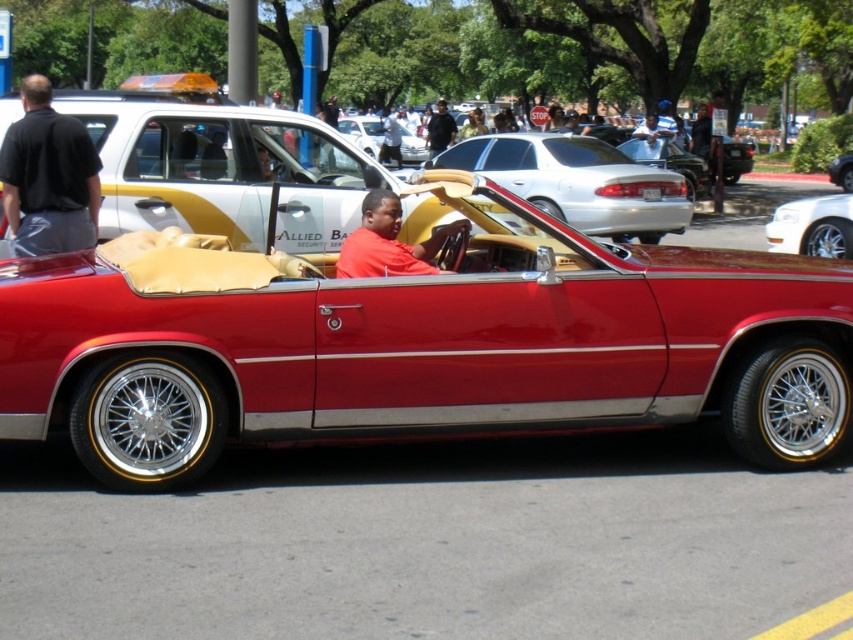
You are a photographer trying to capture a clear shot of the shiny beige leather convertible at center without the matte red shirt at center blocking the view. Can you adjust your position to do so?

The matte red shirt at center has a greater height compared to the shiny beige leather convertible at center, so adjusting your position to a lower angle might allow you to capture the convertible without the shirt blocking the view.

Consider the image. You are a photographer trying to capture a clear shot of the shiny red convertible at center and the matte red shirt at center. If you want to ensure both are fully visible in your frame without any overlap, which object should you position closer to the edge of the frame?

The matte red shirt at center should be positioned closer to the edge of the frame because the shiny red convertible at center is wider than the matte red shirt at center, so it requires more space to fit entirely within the frame.